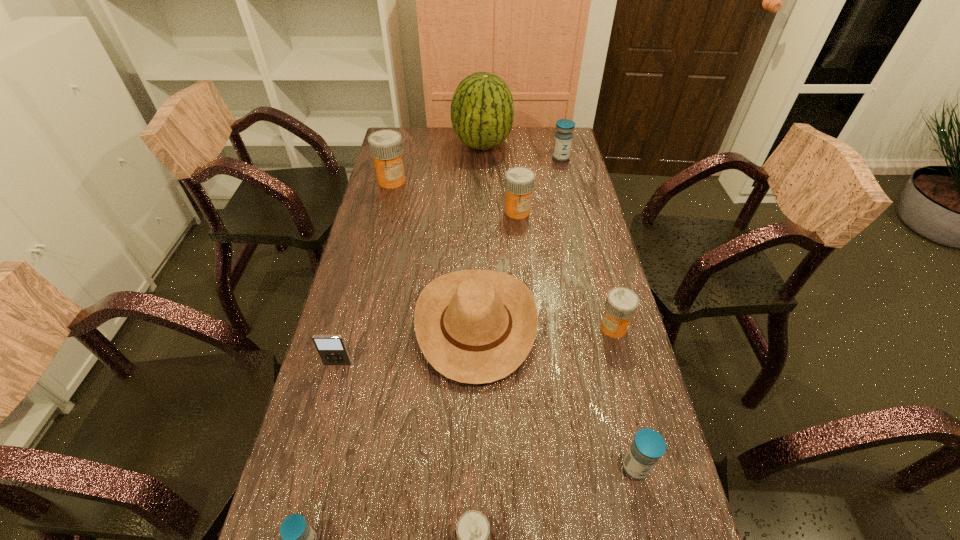
Identify the location of free spot located 0.300m on the label side of the fourth nearest medicine. (489, 328).

Identify the location of vacant space situated 0.320m on the label side of the fourth nearest medicine. This screenshot has height=540, width=960. (481, 328).

Find the location of `vacant area situated on the back of the third nearest object`. vacant area situated on the back of the third nearest object is located at coordinates click(617, 392).

This screenshot has width=960, height=540. Find the location of `free location located on the front-facing side of the iPod`. free location located on the front-facing side of the iPod is located at coordinates (313, 457).

I want to click on watermelon that is at the far edge, so click(x=482, y=110).

This screenshot has height=540, width=960. Identify the location of medicine located at the far edge. (563, 138).

This screenshot has width=960, height=540. Identify the location of medicine that is at the left edge. (386, 147).

Identify the location of iPod that is at the left edge. Image resolution: width=960 pixels, height=540 pixels. (332, 350).

Find the location of a particular element. Image resolution: width=960 pixels, height=540 pixels. object that is at the far right corner is located at coordinates (563, 138).

Where is `blank area at the far edge`? The height and width of the screenshot is (540, 960). blank area at the far edge is located at coordinates pyautogui.click(x=451, y=148).